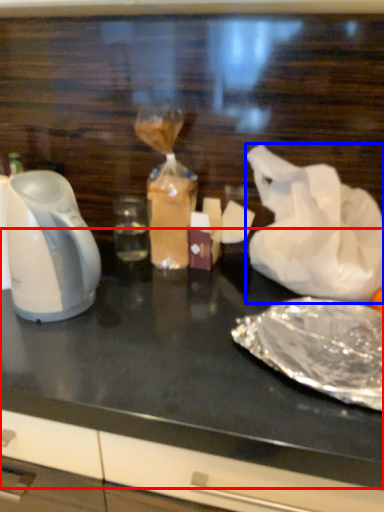
Question: Which object appears farthest to the camera in this image, table top (highlighted by a red box) or plastic bag (highlighted by a blue box)?

Choices:
 (A) table top
 (B) plastic bag

Answer: (B)